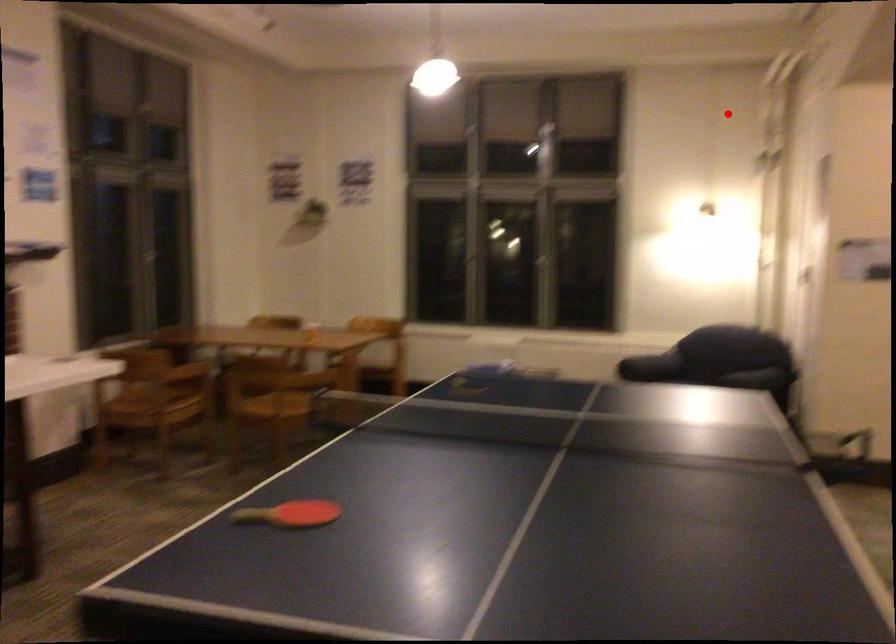
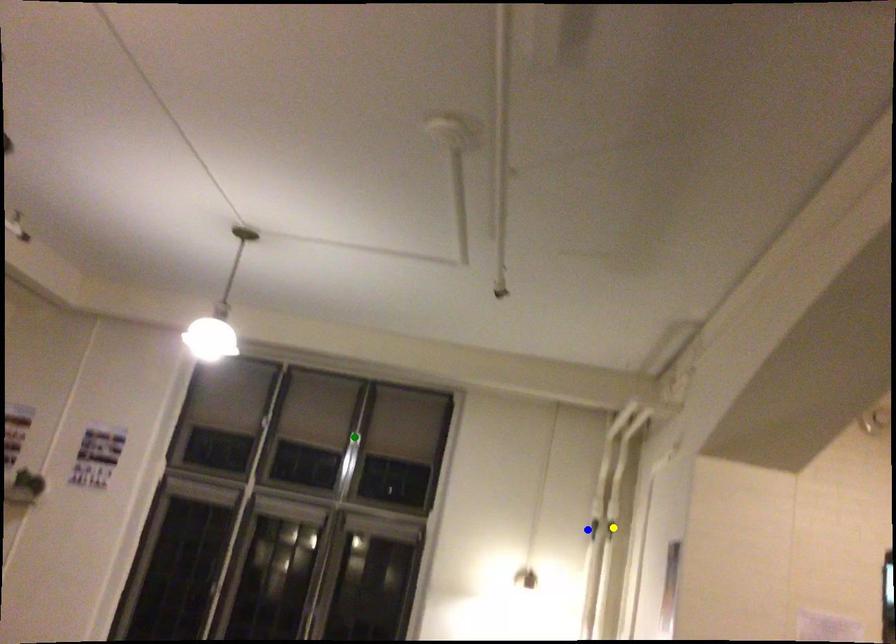
Question: I am providing you with two images of the same scene from different viewpoints. A red point is marked on the first image. You are given multiple points on the second image. In image 2, which mark is for the same physical point as the one in image 1?

Choices:
 (A) green point
 (B) yellow point
 (C) blue point

Answer: (C)